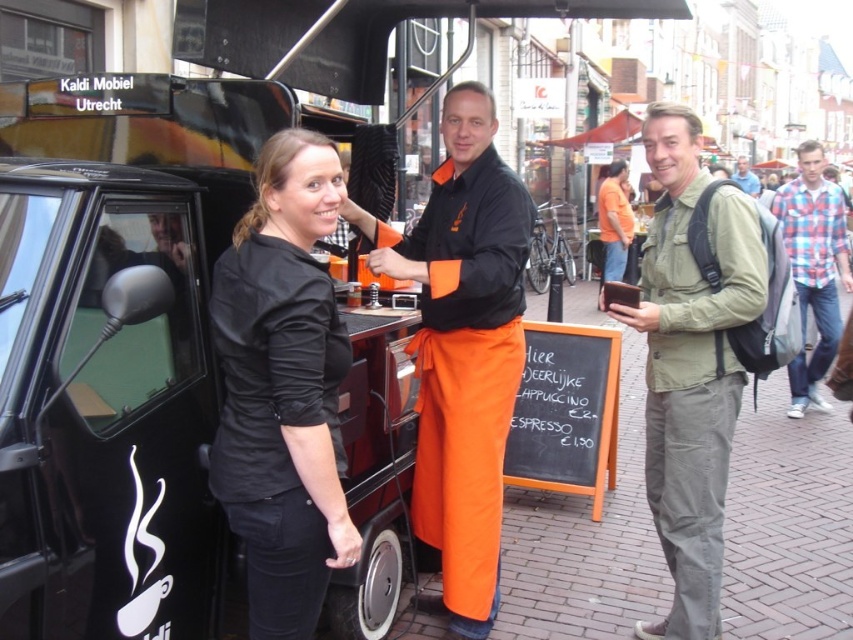
You are a customer standing in front of the Kaldi Mobiel Utrecht coffee truck. You notice the black matte van at left and the plaid cotton shirt at right. Which object is closer to you?

The black matte van at left is closer to you because it is in front of the plaid cotton shirt at right.

You are a customer observing the staff members at the Kaldi Mobiel Utrecht coffee truck. You notice two staff members wearing different clothing items. The first is wearing an orange fabric apron at center, and the second is wearing a plaid cotton shirt at right. Which clothing item has a shorter length?

The orange fabric apron at center is shorter than the plaid cotton shirt at right.

You are a customer looking at the black chalkboard at center and the blue denim jacket at upper right. Which object is smaller in size?

The black chalkboard at center is smaller in size compared to the blue denim jacket at upper right.